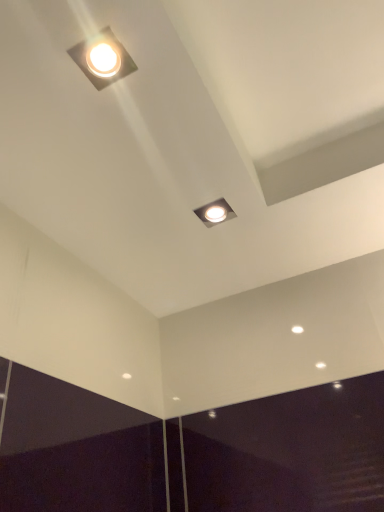
The height and width of the screenshot is (512, 384). Describe the element at coordinates (215, 212) in the screenshot. I see `matte silver square at center, which is the second lamp in top-to-bottom order` at that location.

What is the approximate height of matte silver square at center, the 1th lamp from the bottom?

0.46 inches.

You are a GUI agent. You are given a task and a screenshot of the screen. Output one action in this format:
    pyautogui.click(x=<x>, y=<y>)
    Task: Click on the matte silver square at center, which is counted as the 1th lamp, starting from the right
    
    Given the screenshot: What is the action you would take?
    215,212

Find the location of a particular element. The width and height of the screenshot is (384, 512). matte white square light at upper left, which ranks as the 1th lamp in top-to-bottom order is located at coordinates (103, 59).

What is the approximate width of matte white square light at upper left, arranged as the 1th lamp when viewed from the front?

The width of matte white square light at upper left, arranged as the 1th lamp when viewed from the front, is 3.70 inches.

What do you see at coordinates (103, 59) in the screenshot? This screenshot has height=512, width=384. I see `matte white square light at upper left, which is the 2th lamp in bottom-to-top order` at bounding box center [103, 59].

You are a GUI agent. You are given a task and a screenshot of the screen. Output one action in this format:
    pyautogui.click(x=<x>, y=<y>)
    Task: Click on the matte silver square at center, the 1th lamp from the bottom
    The width and height of the screenshot is (384, 512).
    Given the screenshot: What is the action you would take?
    pyautogui.click(x=215, y=212)

Consider the image. Does matte silver square at center, the second lamp positioned from the front, appear on the left side of matte white square light at upper left, which is the 2th lamp in bottom-to-top order?

Incorrect, matte silver square at center, the second lamp positioned from the front, is not on the left side of matte white square light at upper left, which is the 2th lamp in bottom-to-top order.

Consider the image. Between matte silver square at center, the second lamp positioned from the front, and matte white square light at upper left, which is the second lamp from back to front, which one is positioned in front?

matte white square light at upper left, which is the second lamp from back to front, is in front.

Is point (229, 209) more distant than point (75, 62)?

Yes, point (229, 209) is behind point (75, 62).

From the image's perspective, is matte silver square at center, the second lamp positioned from the front, above or below matte white square light at upper left, which ranks as the 1th lamp in top-to-bottom order?

Clearly, from the image's perspective, matte silver square at center, the second lamp positioned from the front, is below matte white square light at upper left, which ranks as the 1th lamp in top-to-bottom order.

From the picture: From a real-world perspective, which is physically above, matte silver square at center, placed as the second lamp when sorted from left to right, or matte white square light at upper left, arranged as the 1th lamp when viewed from the front?

From a 3D spatial view, matte white square light at upper left, arranged as the 1th lamp when viewed from the front, is above.

Looking at their sizes, would you say matte silver square at center, placed as the second lamp when sorted from left to right, is wider or thinner than matte white square light at upper left, acting as the second lamp starting from the right?

Considering their sizes, matte silver square at center, placed as the second lamp when sorted from left to right, looks broader than matte white square light at upper left, acting as the second lamp starting from the right.

Can you confirm if matte silver square at center, which is counted as the 1th lamp, starting from the right, is shorter than matte white square light at upper left, which ranks as the 1th lamp in top-to-bottom order?

In fact, matte silver square at center, which is counted as the 1th lamp, starting from the right, may be taller than matte white square light at upper left, which ranks as the 1th lamp in top-to-bottom order.

Which of these two, matte silver square at center, which is the second lamp in top-to-bottom order, or matte white square light at upper left, marked as the 1th lamp in a left-to-right arrangement, is bigger?

matte white square light at upper left, marked as the 1th lamp in a left-to-right arrangement, is bigger.

Choose the correct answer: Is matte silver square at center, the second lamp positioned from the front, inside matte white square light at upper left, acting as the second lamp starting from the right, or outside it?

matte silver square at center, the second lamp positioned from the front, cannot be found inside matte white square light at upper left, acting as the second lamp starting from the right.

Are matte silver square at center, which is counted as the first lamp, starting from the back, and matte white square light at upper left, arranged as the 1th lamp when viewed from the front, far apart?

Actually, matte silver square at center, which is counted as the first lamp, starting from the back, and matte white square light at upper left, arranged as the 1th lamp when viewed from the front, are a little close together.

Is matte silver square at center, which is counted as the 1th lamp, starting from the right, looking in the opposite direction of matte white square light at upper left, arranged as the 1th lamp when viewed from the front?

No, matte white square light at upper left, arranged as the 1th lamp when viewed from the front, is not at the back of matte silver square at center, which is counted as the 1th lamp, starting from the right.

How far apart are matte silver square at center, which is counted as the 1th lamp, starting from the right, and matte white square light at upper left, which ranks as the 1th lamp in top-to-bottom order?

matte silver square at center, which is counted as the 1th lamp, starting from the right, and matte white square light at upper left, which ranks as the 1th lamp in top-to-bottom order, are 16.25 inches apart from each other.

Locate an element on the screen. This screenshot has height=512, width=384. lamp below the matte white square light at upper left, which is the 2th lamp in bottom-to-top order (from a real-world perspective) is located at coordinates (215, 212).

Can you confirm if matte white square light at upper left, which ranks as the 1th lamp in top-to-bottom order, is positioned to the right of matte silver square at center, the second lamp positioned from the front?

In fact, matte white square light at upper left, which ranks as the 1th lamp in top-to-bottom order, is to the left of matte silver square at center, the second lamp positioned from the front.

Which object is further away from the camera, matte white square light at upper left, which is the 2th lamp in bottom-to-top order, or matte silver square at center, which is the second lamp in top-to-bottom order?

matte silver square at center, which is the second lamp in top-to-bottom order.

Is point (95, 78) farther from camera compared to point (225, 220)?

No, (95, 78) is closer to viewer.

From the image's perspective, which is above, matte white square light at upper left, marked as the 1th lamp in a left-to-right arrangement, or matte silver square at center, which is counted as the first lamp, starting from the back?

From the image's view, matte white square light at upper left, marked as the 1th lamp in a left-to-right arrangement, is above.

From a real-world perspective, is matte white square light at upper left, acting as the second lamp starting from the right, physically above matte silver square at center, the 1th lamp from the bottom?

Indeed, from a real-world perspective, matte white square light at upper left, acting as the second lamp starting from the right, stands above matte silver square at center, the 1th lamp from the bottom.

Can you confirm if matte white square light at upper left, arranged as the 1th lamp when viewed from the front, is thinner than matte silver square at center, the second lamp positioned from the front?

Yes, matte white square light at upper left, arranged as the 1th lamp when viewed from the front, is thinner than matte silver square at center, the second lamp positioned from the front.

Considering the relative sizes of matte white square light at upper left, marked as the 1th lamp in a left-to-right arrangement, and matte silver square at center, which is counted as the 1th lamp, starting from the right, in the image provided, is matte white square light at upper left, marked as the 1th lamp in a left-to-right arrangement, taller than matte silver square at center, which is counted as the 1th lamp, starting from the right,?

No, matte white square light at upper left, marked as the 1th lamp in a left-to-right arrangement, is not taller than matte silver square at center, which is counted as the 1th lamp, starting from the right.

Considering the sizes of objects matte white square light at upper left, arranged as the 1th lamp when viewed from the front, and matte silver square at center, placed as the second lamp when sorted from left to right, in the image provided, who is smaller, matte white square light at upper left, arranged as the 1th lamp when viewed from the front, or matte silver square at center, placed as the second lamp when sorted from left to right,?

matte silver square at center, placed as the second lamp when sorted from left to right, is smaller.

Looking at this image, is matte white square light at upper left, arranged as the 1th lamp when viewed from the front, not inside matte silver square at center, the second lamp positioned from the front?

Yes.

Is matte white square light at upper left, marked as the 1th lamp in a left-to-right arrangement, beside matte silver square at center, the second lamp positioned from the front?

No, matte white square light at upper left, marked as the 1th lamp in a left-to-right arrangement, is not with matte silver square at center, the second lamp positioned from the front.

Based on the photo, is matte white square light at upper left, which ranks as the 1th lamp in top-to-bottom order, facing away from matte silver square at center, placed as the second lamp when sorted from left to right?

No.

What's the angular difference between matte white square light at upper left, which ranks as the 1th lamp in top-to-bottom order, and matte silver square at center, which is counted as the 1th lamp, starting from the right,'s facing directions?

There is a 0.00103-degree angle between the facing directions of matte white square light at upper left, which ranks as the 1th lamp in top-to-bottom order, and matte silver square at center, which is counted as the 1th lamp, starting from the right.

Identify the location of lamp on the left of the matte silver square at center, the second lamp positioned from the front. (103, 59).

Find the location of `lamp that appears below the matte white square light at upper left, arranged as the 1th lamp when viewed from the front (from a real-world perspective)`. lamp that appears below the matte white square light at upper left, arranged as the 1th lamp when viewed from the front (from a real-world perspective) is located at coordinates (215, 212).

At what (x,y) coordinates should I click in order to perform the action: click on lamp that is in front of the matte silver square at center, placed as the second lamp when sorted from left to right. Please return your answer as a coordinate pair (x, y). This screenshot has height=512, width=384. Looking at the image, I should click on [x=103, y=59].